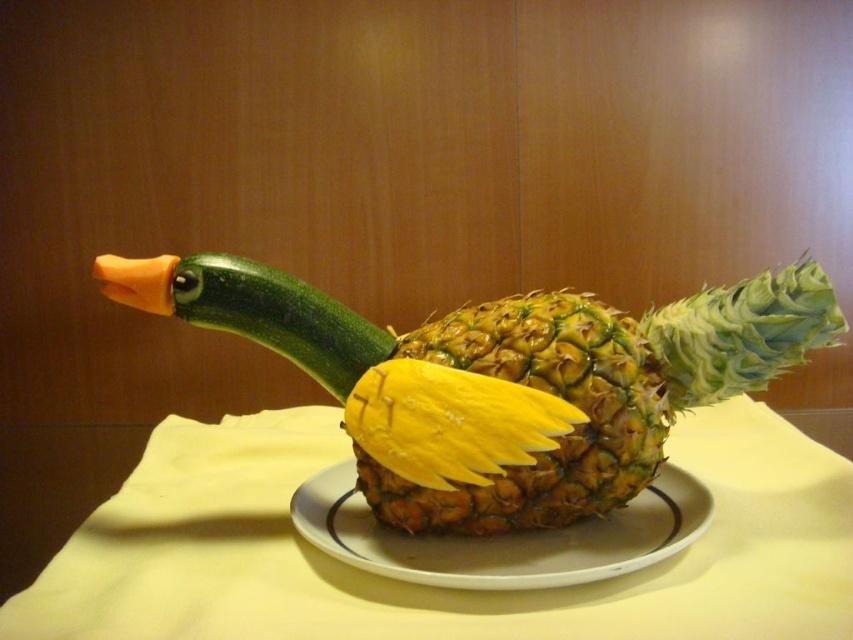
You are a chef standing 1 meter away from the yellow fabric at center where the fruit carving is displayed. Can you reach the fruit carving without moving closer?

The distance between the yellow fabric at center and the viewer is 39.28 centimeters, which is less than 1 meter. Therefore, you can reach the fruit carving without moving closer.

You are a chef preparing a display for a food festival. You have a yellow fabric at center and a yellow textured pineapple at center. Which object should you place on top of the other to ensure stability?

The yellow fabric at center is bigger than the yellow textured pineapple at center, so placing the pineapple on top of the fabric would provide better stability due to the larger base area.

Based on the photo, you are an artist who wants to place a small decoration exactly at the point with coordinates (437, 588) on the image. What object will the decoration land on?

The point with coordinates (437, 588) corresponds to the yellow fabric at center, so the decoration will land on the yellow fabric at center.